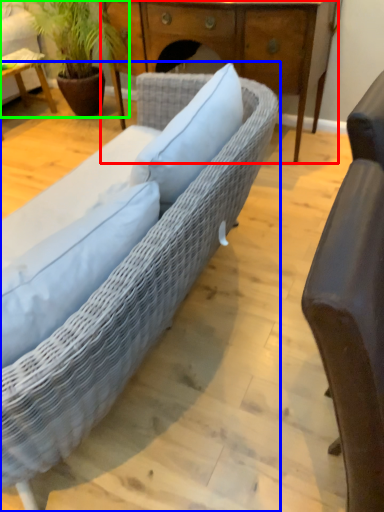
Question: Estimate the real-world distances between objects in this image. Which object is farther from desk (highlighted by a red box), studio couch (highlighted by a blue box) or houseplant (highlighted by a green box)?

Choices:
 (A) studio couch
 (B) houseplant

Answer: (A)